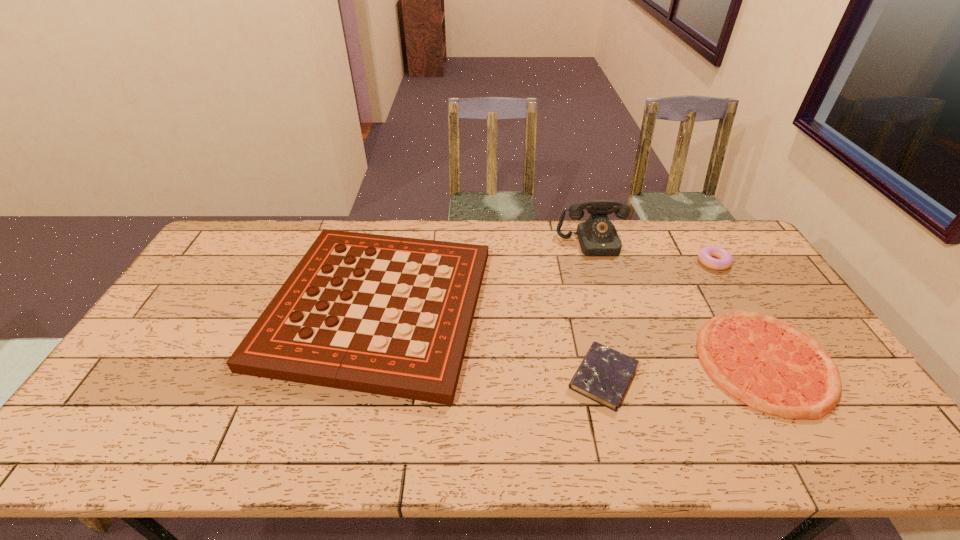
The width and height of the screenshot is (960, 540). In order to click on free space at the right edge of the desktop in this screenshot , I will do `click(742, 279)`.

At what (x,y) coordinates should I click in order to perform the action: click on vacant space at the far right corner of the desktop. Please return your answer as a coordinate pair (x, y). Looking at the image, I should click on (737, 233).

Where is `free space between the pizza and the diary`? free space between the pizza and the diary is located at coordinates (684, 369).

This screenshot has width=960, height=540. Identify the location of free spot between the diary and the tallest object. (598, 310).

I want to click on empty space between the diary and the leftmost object, so click(491, 342).

Identify the location of free point between the leftmost object and the pizza. (571, 334).

The height and width of the screenshot is (540, 960). I want to click on vacant space that is in between the doughnut and the diary, so click(659, 320).

The height and width of the screenshot is (540, 960). I want to click on blank region between the fourth shortest object and the pizza, so click(x=571, y=334).

Find the location of `free space between the telephone and the leftmost object`. free space between the telephone and the leftmost object is located at coordinates (485, 275).

Image resolution: width=960 pixels, height=540 pixels. I want to click on free area in between the gameboard and the diary, so click(491, 342).